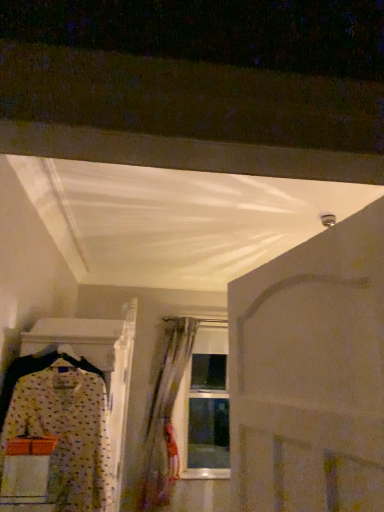
Question: Is translucent fabric curtain at center smaller than white matte door at center?

Choices:
 (A) yes
 (B) no

Answer: (B)

Question: Is translucent fabric curtain at center not near white matte door at center?

Choices:
 (A) no
 (B) yes

Answer: (B)

Question: Does translucent fabric curtain at center contain white matte door at center?

Choices:
 (A) no
 (B) yes

Answer: (A)

Question: Does translucent fabric curtain at center turn towards white matte door at center?

Choices:
 (A) yes
 (B) no

Answer: (A)

Question: From the image's perspective, is translucent fabric curtain at center beneath white matte door at center?

Choices:
 (A) no
 (B) yes

Answer: (B)

Question: Considering the relative positions of translucent fabric curtain at center and white matte door at center in the image provided, is translucent fabric curtain at center to the right of white matte door at center from the viewer's perspective?

Choices:
 (A) no
 (B) yes

Answer: (A)

Question: From the image's perspective, is translucent fabric curtain at center on top of polka dot fabric dress at left?

Choices:
 (A) no
 (B) yes

Answer: (A)

Question: Would you say translucent fabric curtain at center contains polka dot fabric dress at left?

Choices:
 (A) no
 (B) yes

Answer: (A)

Question: Considering the relative positions of translucent fabric curtain at center and polka dot fabric dress at left in the image provided, is translucent fabric curtain at center to the right of polka dot fabric dress at left from the viewer's perspective?

Choices:
 (A) yes
 (B) no

Answer: (A)

Question: Can you confirm if translucent fabric curtain at center is smaller than polka dot fabric dress at left?

Choices:
 (A) yes
 (B) no

Answer: (B)

Question: Is translucent fabric curtain at center beside polka dot fabric dress at left?

Choices:
 (A) no
 (B) yes

Answer: (A)

Question: Does translucent fabric curtain at center have a larger size compared to polka dot fabric dress at left?

Choices:
 (A) no
 (B) yes

Answer: (B)

Question: Considering the relative sizes of white matte door at center and translucent fabric curtain at center in the image provided, is white matte door at center taller than translucent fabric curtain at center?

Choices:
 (A) yes
 (B) no

Answer: (B)